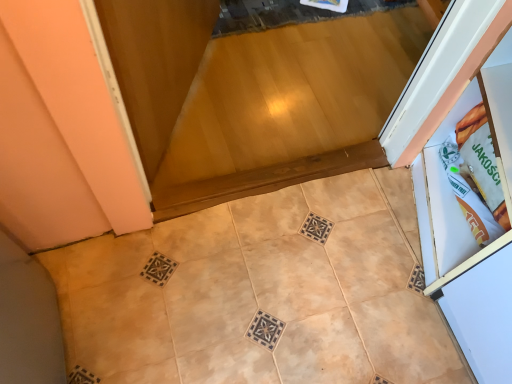
I want to click on free space above beige matte tile at center, the second ceramic tile when ordered from right to left (from a real-world perspective), so click(x=218, y=329).